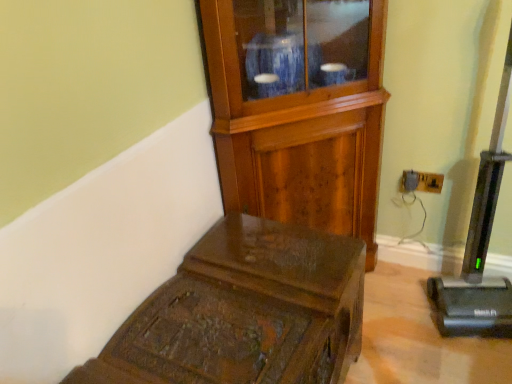
Question: Which is correct: wooden trunk at lower left is inside black plastic vacuum cleaner at right, or outside of it?

Choices:
 (A) inside
 (B) outside

Answer: (B)

Question: Is wooden trunk at lower left bigger or smaller than black plastic vacuum cleaner at right?

Choices:
 (A) big
 (B) small

Answer: (A)

Question: Considering the real-world distances, which object is farthest from the wooden trunk at lower left?

Choices:
 (A) wooden side cabinet at center
 (B) black plastic vacuum cleaner at right

Answer: (B)

Question: Which is nearer to the black plastic vacuum cleaner at right?

Choices:
 (A) wooden side cabinet at center
 (B) wooden trunk at lower left

Answer: (A)